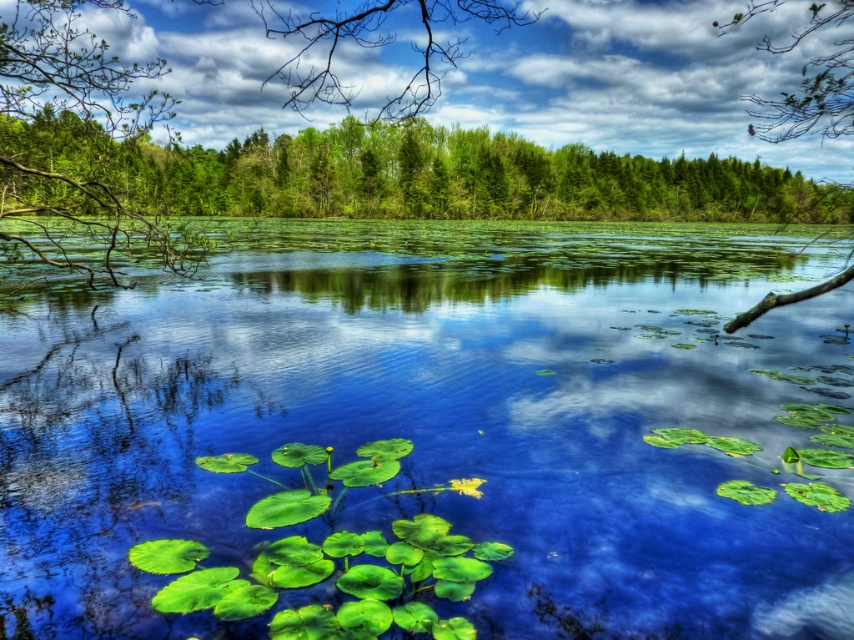
In the scene shown: You are standing at the edge of the pond and see two points on the water surface, point 1 at coordinates point (825, 387) and point 2 at coordinates point (784, 134). Which point is closer to you?

Point (825, 387) is in front of point (784, 134), so it is closer to you.

You are standing at the edge of the pond and want to take a photo of the green leafy tree at upper center. If your camera has a maximum zoom range of 10 meters, will you be able to capture the entire tree in the photo without moving closer?

The green leafy tree at upper center and camera are 10.76 meters apart. Since the camera can only zoom up to 10 meters, you will not be able to capture the entire tree without moving closer.